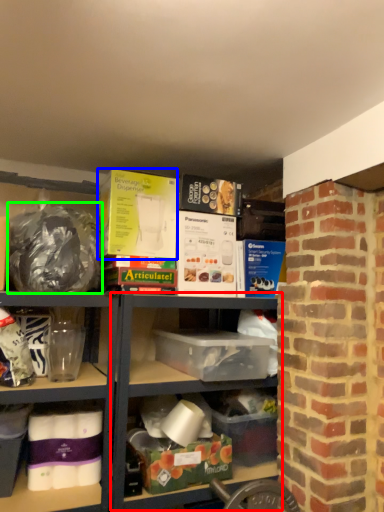
Question: Which is farther away from shelf (highlighted by a red box)? box (highlighted by a blue box) or waste (highlighted by a green box)?

Choices:
 (A) box
 (B) waste

Answer: (A)